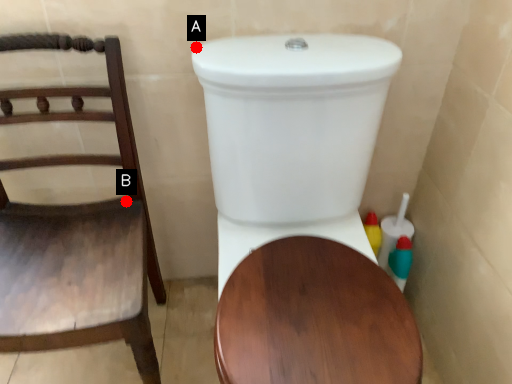
Question: Two points are circled on the image, labeled by A and B beside each circle. Which point is farther from the camera taking this photo?

Choices:
 (A) A is further
 (B) B is further

Answer: (B)